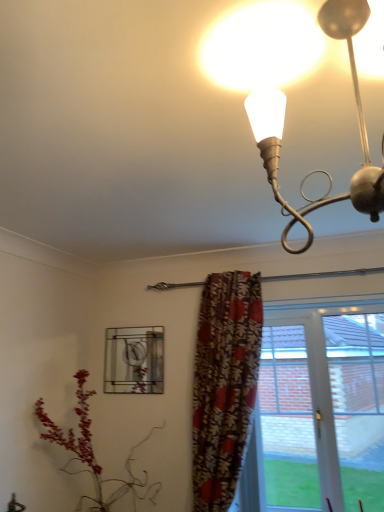
This screenshot has width=384, height=512. I want to click on matte white bulb at upper right, so click(284, 94).

The width and height of the screenshot is (384, 512). In order to click on transparent glass door at center, which is counted as the first window, starting from the right in this screenshot , I will do `click(318, 409)`.

I want to click on stained glass window at center, the 1th window viewed from the left, so click(134, 360).

Where is `floral fabric curtain at center`? This screenshot has width=384, height=512. floral fabric curtain at center is located at coordinates (224, 384).

From a real-world perspective, is matte white bulb at upper right above or below floral fabric curtain at center?

matte white bulb at upper right is situated higher than floral fabric curtain at center in the real world.

Does point (272, 78) lie behind point (211, 333)?

No.

Between matte white bulb at upper right and floral fabric curtain at center, which one has smaller size?

matte white bulb at upper right.

Considering the positions of objects matte white bulb at upper right and floral fabric curtain at center in the image provided, who is behind, matte white bulb at upper right or floral fabric curtain at center?

floral fabric curtain at center is more distant.

From the image's perspective, is transparent glass door at center, the 2th window positioned from the left, below stained glass window at center, the 1th window viewed from the left?

Yes, from the image's perspective, transparent glass door at center, the 2th window positioned from the left, is below stained glass window at center, the 1th window viewed from the left.

Considering the relative sizes of transparent glass door at center, which is counted as the first window, starting from the right, and stained glass window at center, the 2th window from the right, in the image provided, is transparent glass door at center, which is counted as the first window, starting from the right, smaller than stained glass window at center, the 2th window from the right,?

Incorrect, transparent glass door at center, which is counted as the first window, starting from the right, is not smaller in size than stained glass window at center, the 2th window from the right.

Looking at this image, considering the relative positions of transparent glass door at center, which is counted as the first window, starting from the right, and stained glass window at center, the 1th window viewed from the left, in the image provided, is transparent glass door at center, which is counted as the first window, starting from the right, to the left of stained glass window at center, the 1th window viewed from the left, from the viewer's perspective?

No.

From the image's perspective, is transparent glass door at center, the 2th window positioned from the left, positioned above or below matte white bulb at upper right?

Clearly, from the image's perspective, transparent glass door at center, the 2th window positioned from the left, is below matte white bulb at upper right.

How distant is transparent glass door at center, the 2th window positioned from the left, from matte white bulb at upper right?

transparent glass door at center, the 2th window positioned from the left, is 1.57 meters away from matte white bulb at upper right.

Considering the relative sizes of transparent glass door at center, which is counted as the first window, starting from the right, and matte white bulb at upper right in the image provided, is transparent glass door at center, which is counted as the first window, starting from the right, taller than matte white bulb at upper right?

Indeed, transparent glass door at center, which is counted as the first window, starting from the right, has a greater height compared to matte white bulb at upper right.

Are transparent glass door at center, which is counted as the first window, starting from the right, and matte white bulb at upper right located far from each other?

Yes, transparent glass door at center, which is counted as the first window, starting from the right, and matte white bulb at upper right are located far from each other.

Is point (223, 340) closer or farther from the camera than point (346, 461)?

Clearly, point (223, 340) is closer to the camera than point (346, 461).

From the image's perspective, is floral fabric curtain at center located above or below transparent glass door at center, which is counted as the first window, starting from the right?

From the image's perspective, floral fabric curtain at center appears above transparent glass door at center, which is counted as the first window, starting from the right.

Looking at this image, is floral fabric curtain at center facing away from transparent glass door at center, the 2th window positioned from the left?

floral fabric curtain at center is not turned away from transparent glass door at center, the 2th window positioned from the left.

From a real-world perspective, is floral fabric curtain at center on transparent glass door at center, the 2th window positioned from the left?

Yes, from a real-world perspective, floral fabric curtain at center is on top of transparent glass door at center, the 2th window positioned from the left.

Considering the sizes of objects stained glass window at center, the 1th window viewed from the left, and floral fabric curtain at center in the image provided, who is shorter, stained glass window at center, the 1th window viewed from the left, or floral fabric curtain at center?

stained glass window at center, the 1th window viewed from the left, is shorter.

Does stained glass window at center, the 1th window viewed from the left, have a larger size compared to floral fabric curtain at center?

Incorrect, stained glass window at center, the 1th window viewed from the left, is not larger than floral fabric curtain at center.

Is point (109, 378) closer or farther from the camera than point (208, 499)?

Point (109, 378) is farther from the camera than point (208, 499).

Is stained glass window at center, the 2th window from the right, wider than floral fabric curtain at center?

Incorrect, the width of stained glass window at center, the 2th window from the right, does not surpass that of floral fabric curtain at center.

Considering the points (244, 370) and (324, 28), which point is in front, point (244, 370) or point (324, 28)?

The point (324, 28) is closer to the camera.

Is floral fabric curtain at center next to matte white bulb at upper right?

floral fabric curtain at center and matte white bulb at upper right are clearly separated.

Is floral fabric curtain at center aimed at matte white bulb at upper right?

Yes, floral fabric curtain at center faces towards matte white bulb at upper right.

Does floral fabric curtain at center contain matte white bulb at upper right?

That's incorrect, matte white bulb at upper right is not inside floral fabric curtain at center.

Is stained glass window at center, the 2th window from the right, aimed at matte white bulb at upper right?

No, stained glass window at center, the 2th window from the right, does not turn towards matte white bulb at upper right.

From a real-world perspective, which object stands above the other?

In real-world perspective, matte white bulb at upper right is above.

Does stained glass window at center, the 1th window viewed from the left, have a lesser height compared to matte white bulb at upper right?

Yes.

In the scene shown: Can you confirm if stained glass window at center, the 2th window from the right, is positioned to the right of matte white bulb at upper right?

No, stained glass window at center, the 2th window from the right, is not to the right of matte white bulb at upper right.

Find the location of `curtain lying behind the matte white bulb at upper right`. curtain lying behind the matte white bulb at upper right is located at coordinates (224, 384).

Locate an element on the screen. The image size is (384, 512). window below the stained glass window at center, the 2th window from the right (from a real-world perspective) is located at coordinates (318, 409).

Which object lies nearer to the anchor point matte white bulb at upper right, transparent glass door at center, the 2th window positioned from the left, or floral fabric curtain at center?

Based on the image, floral fabric curtain at center appears to be nearer to matte white bulb at upper right.

Looking at the image, which one is located closer to stained glass window at center, the 2th window from the right, matte white bulb at upper right or floral fabric curtain at center?

The object closer to stained glass window at center, the 2th window from the right, is floral fabric curtain at center.

Considering their positions, is floral fabric curtain at center positioned further to matte white bulb at upper right than transparent glass door at center, which is counted as the first window, starting from the right?

transparent glass door at center, which is counted as the first window, starting from the right, lies further to matte white bulb at upper right than the other object.

Based on their spatial positions, is transparent glass door at center, the 2th window positioned from the left, or stained glass window at center, the 2th window from the right, closer to floral fabric curtain at center?

transparent glass door at center, the 2th window positioned from the left, is closer to floral fabric curtain at center.

Looking at the image, which one is located further to floral fabric curtain at center, matte white bulb at upper right or transparent glass door at center, which is counted as the first window, starting from the right?

Among the two, matte white bulb at upper right is located further to floral fabric curtain at center.

Which object lies further to the anchor point floral fabric curtain at center, matte white bulb at upper right or stained glass window at center, the 2th window from the right?

Based on the image, matte white bulb at upper right appears to be further to floral fabric curtain at center.

Consider the image. From the image, which object appears to be farther from matte white bulb at upper right, floral fabric curtain at center or stained glass window at center, the 2th window from the right?

The object further to matte white bulb at upper right is stained glass window at center, the 2th window from the right.

Estimate the real-world distances between objects in this image. Which object is closer to transparent glass door at center, which is counted as the first window, starting from the right, matte white bulb at upper right or stained glass window at center, the 1th window viewed from the left?

stained glass window at center, the 1th window viewed from the left, is closer to transparent glass door at center, which is counted as the first window, starting from the right.

Locate an element on the screen. The image size is (384, 512). curtain between stained glass window at center, the 1th window viewed from the left, and transparent glass door at center, the 2th window positioned from the left is located at coordinates (224, 384).

You are a GUI agent. You are given a task and a screenshot of the screen. Output one action in this format:
    pyautogui.click(x=<x>, y=<y>)
    Task: Click on the curtain between matte white bulb at upper right and stained glass window at center, the 2th window from the right, along the z-axis
    This screenshot has height=512, width=384.
    Given the screenshot: What is the action you would take?
    pyautogui.click(x=224, y=384)

Image resolution: width=384 pixels, height=512 pixels. Find the location of `curtain located between matte white bulb at upper right and transparent glass door at center, which is counted as the first window, starting from the right, in the depth direction`. curtain located between matte white bulb at upper right and transparent glass door at center, which is counted as the first window, starting from the right, in the depth direction is located at coordinates (224, 384).

Where is `window between matte white bulb at upper right and stained glass window at center, the 1th window viewed from the left, from front to back`? This screenshot has height=512, width=384. window between matte white bulb at upper right and stained glass window at center, the 1th window viewed from the left, from front to back is located at coordinates (318, 409).